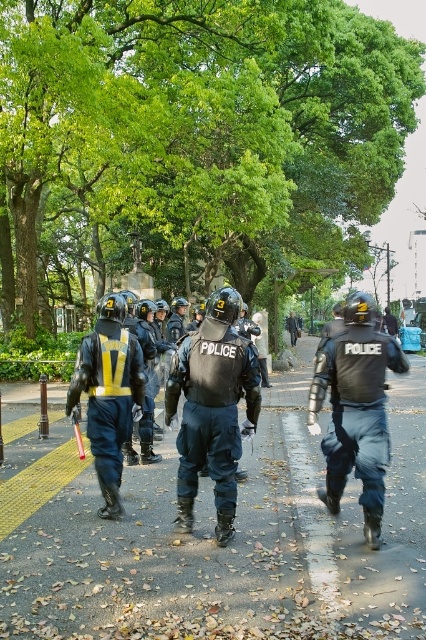
Question: Which object is farther from the camera taking this photo?

Choices:
 (A) reflective blue vest at center
 (B) matte black police uniform at center

Answer: (A)

Question: Does matte black vest at center have a smaller size compared to reflective blue vest at center?

Choices:
 (A) no
 (B) yes

Answer: (B)

Question: Does matte black vest at center appear over reflective blue vest at center?

Choices:
 (A) yes
 (B) no

Answer: (B)

Question: Considering the real-world distances, which object is farthest from the matte black vest at center?

Choices:
 (A) matte black police uniform at center
 (B) smooth asphalt road at center
 (C) reflective blue vest at center

Answer: (B)

Question: Does smooth asphalt road at center have a smaller size compared to matte black police uniform at center?

Choices:
 (A) yes
 (B) no

Answer: (B)

Question: Which object is positioned closest to the matte black police uniform at center?

Choices:
 (A) reflective blue vest at center
 (B) smooth asphalt road at center
 (C) matte black vest at center

Answer: (C)